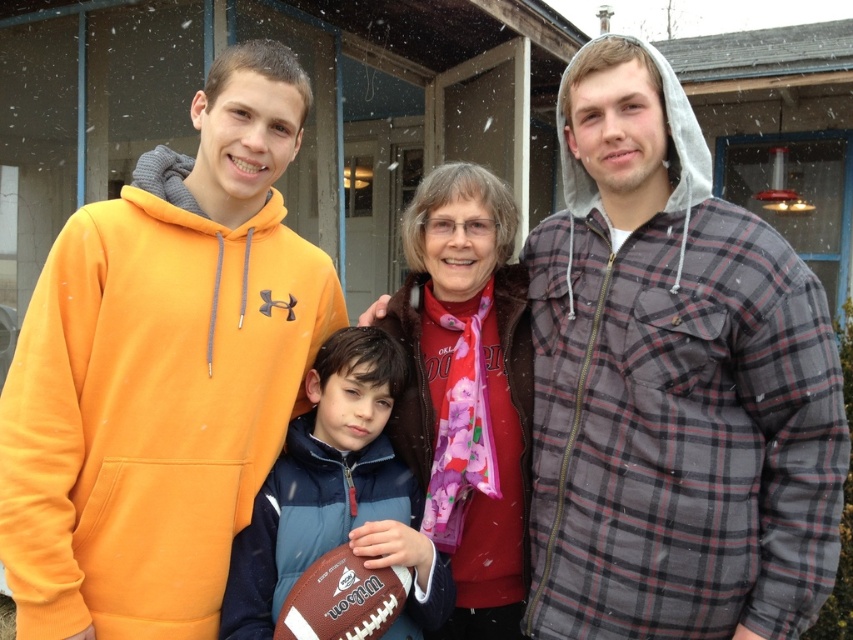
Question: Is orange fleece hoodie at left to the left of blue fleece jacket at center from the viewer's perspective?

Choices:
 (A) yes
 (B) no

Answer: (A)

Question: Does orange fleece hoodie at left lie in front of floral scarf at center?

Choices:
 (A) yes
 (B) no

Answer: (A)

Question: Which object is closer to the camera taking this photo?

Choices:
 (A) floral scarf at center
 (B) plaid flannel shirt at right
 (C) white leather football at center

Answer: (C)

Question: Can you confirm if plaid flannel shirt at right is bigger than orange fleece hoodie at left?

Choices:
 (A) yes
 (B) no

Answer: (B)

Question: Which point is farther to the camera?

Choices:
 (A) (268, 460)
 (B) (380, 589)

Answer: (A)

Question: Based on their relative distances, which object is nearer to the plaid flannel shirt at right?

Choices:
 (A) orange fleece hoodie at left
 (B) blue fleece jacket at center
 (C) floral scarf at center

Answer: (C)